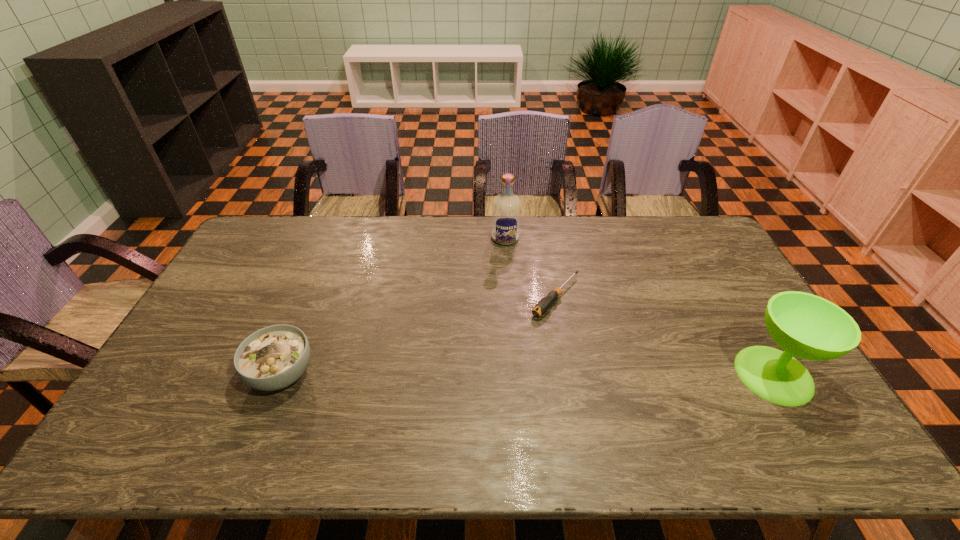
Locate an element on the screen. The height and width of the screenshot is (540, 960). free space between the third object from right to left and the rightmost object is located at coordinates (639, 306).

This screenshot has width=960, height=540. I want to click on unoccupied position between the second tallest object and the second farthest object, so click(664, 336).

Find the location of a particular element. The height and width of the screenshot is (540, 960). vacant space that's between the rightmost object and the tallest object is located at coordinates (639, 306).

The width and height of the screenshot is (960, 540). Identify the location of free space between the second object from right to left and the soup bowl. (419, 335).

At what (x,y) coordinates should I click in order to perform the action: click on free space between the vodka and the third object from left to right. Please return your answer as a coordinate pair (x, y). Looking at the image, I should click on (531, 267).

Identify the location of empty space between the leftmost object and the rightmost object. (528, 374).

I want to click on empty space between the leftmost object and the vodka, so click(394, 306).

Select which object appears as the third closest to the leftmost object. Please provide its 2D coordinates. Your answer should be formatted as a tuple, i.e. [(x, y)], where the tuple contains the x and y coordinates of a point satisfying the conditions above.

[(804, 325)]

Identify which object is located as the second nearest to the rightmost object. Please provide its 2D coordinates. Your answer should be formatted as a tuple, i.e. [(x, y)], where the tuple contains the x and y coordinates of a point satisfying the conditions above.

[(506, 208)]

Find the location of a particular element. Image resolution: width=960 pixels, height=540 pixels. vacant space that satisfies the following two spatial constraints: 1. on the front side of the tallest object; 2. on the left side of the shortest object is located at coordinates (510, 297).